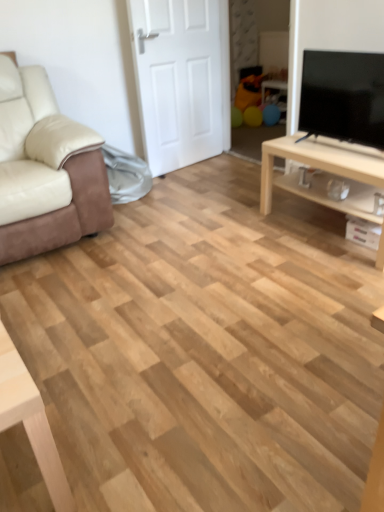
Question: Does light wood/texture tv stand at right have a greater width compared to black glossy tv at upper right?

Choices:
 (A) no
 (B) yes

Answer: (B)

Question: Could you tell me if light wood/texture tv stand at right is facing black glossy tv at upper right?

Choices:
 (A) no
 (B) yes

Answer: (A)

Question: Is light wood/texture tv stand at right beside black glossy tv at upper right?

Choices:
 (A) no
 (B) yes

Answer: (A)

Question: From the image's perspective, is light wood/texture tv stand at right under black glossy tv at upper right?

Choices:
 (A) yes
 (B) no

Answer: (A)

Question: Is light wood/texture tv stand at right positioned in front of black glossy tv at upper right?

Choices:
 (A) yes
 (B) no

Answer: (B)

Question: From a real-world perspective, is light wood/texture tv stand at right positioned over black glossy tv at upper right based on gravity?

Choices:
 (A) yes
 (B) no

Answer: (B)

Question: Can you confirm if white matte door at center is thinner than beige leather couch at left?

Choices:
 (A) yes
 (B) no

Answer: (A)

Question: From the image's perspective, is white matte door at center located beneath beige leather couch at left?

Choices:
 (A) no
 (B) yes

Answer: (A)

Question: Does white matte door at center have a smaller size compared to beige leather couch at left?

Choices:
 (A) yes
 (B) no

Answer: (A)

Question: Is white matte door at center wider than beige leather couch at left?

Choices:
 (A) yes
 (B) no

Answer: (B)

Question: Considering the relative sizes of white matte door at center and beige leather couch at left in the image provided, is white matte door at center taller than beige leather couch at left?

Choices:
 (A) yes
 (B) no

Answer: (A)

Question: Is white matte door at center not near beige leather couch at left?

Choices:
 (A) no
 (B) yes

Answer: (B)

Question: Is black glossy tv at upper right at the left side of light wood/texture tv stand at right?

Choices:
 (A) no
 (B) yes

Answer: (B)